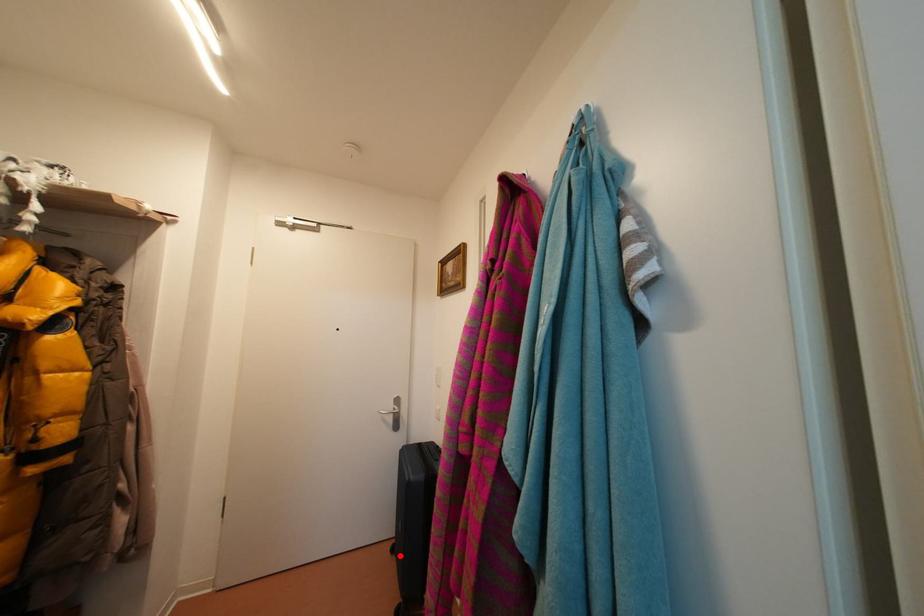
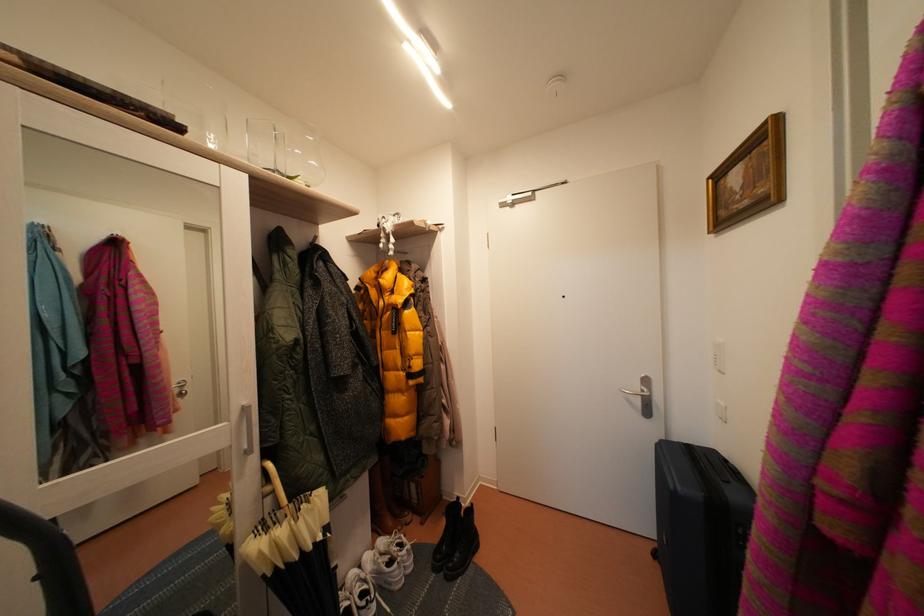
In the second image, find the point that corresponds to the highlighted location in the first image.

(662, 561)